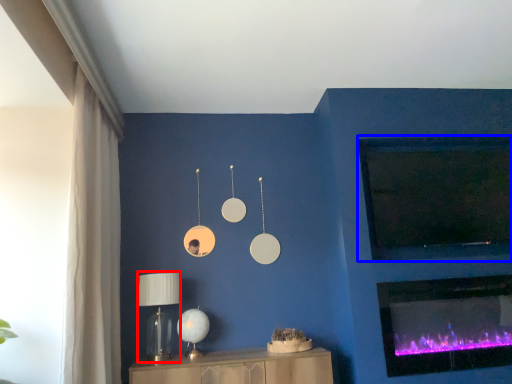
Question: Which point is further to the camera, table lamp (highlighted by a red box) or window screen (highlighted by a blue box)?

Choices:
 (A) table lamp
 (B) window screen

Answer: (B)